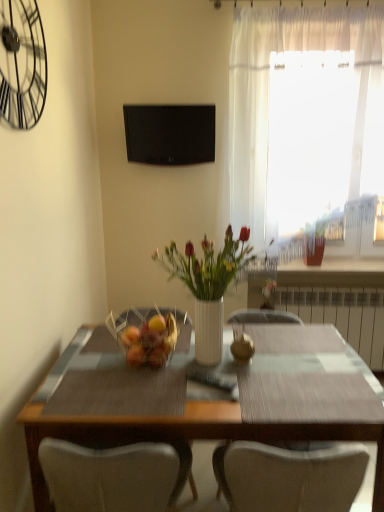
The width and height of the screenshot is (384, 512). In order to click on vacant area that is situated to the right of translucent glass basket at center in this screenshot , I will do `click(205, 365)`.